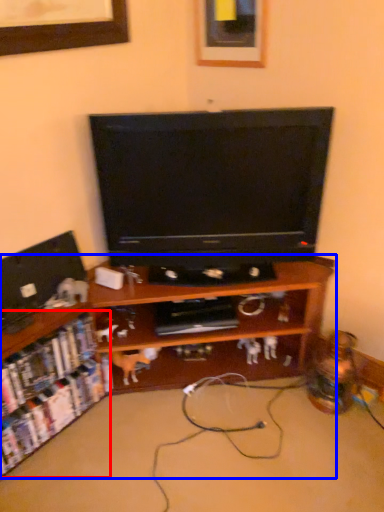
Question: Which object is closer to the camera taking this photo, shelf (highlighted by a red box) or shelf (highlighted by a blue box)?

Choices:
 (A) shelf
 (B) shelf

Answer: (B)